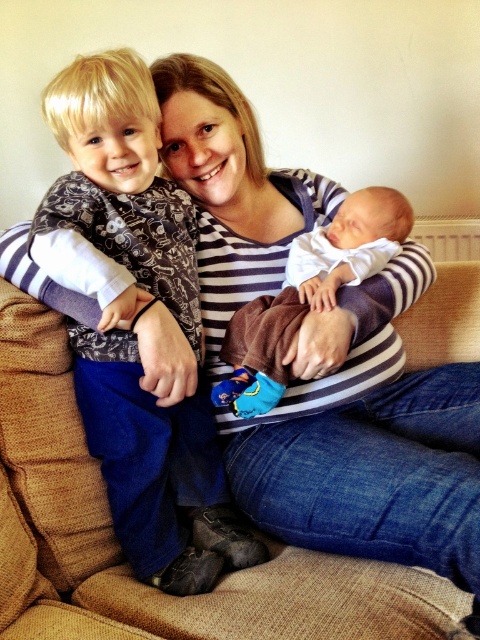
Who is shorter, striped fabric at center or brown soft blanket at center?

Standing shorter between the two is brown soft blanket at center.

The width and height of the screenshot is (480, 640). What do you see at coordinates (368, 440) in the screenshot?
I see `striped fabric at center` at bounding box center [368, 440].

Where is `striped fabric at center`? The width and height of the screenshot is (480, 640). striped fabric at center is located at coordinates (368, 440).

Is striped fabric at center to the right of matte black shirt at left from the viewer's perspective?

Indeed, striped fabric at center is positioned on the right side of matte black shirt at left.

Which is in front, point (324, 321) or point (158, 452)?

Positioned in front is point (158, 452).

Between point (448, 416) and point (120, 317), which one is positioned behind?

Point (448, 416)

In order to click on striped fabric at center in this screenshot , I will do `click(368, 440)`.

Does matte black shirt at left have a smaller size compared to brown soft blanket at center?

No, matte black shirt at left is not smaller than brown soft blanket at center.

Can you confirm if matte black shirt at left is positioned above brown soft blanket at center?

No.

Who is more distant from viewer, [107,144] or [403,228]?

The point [403,228] is behind.

At what (x,y) coordinates should I click in order to perform the action: click on matte black shirt at left. Please return your answer as a coordinate pair (x, y). Looking at the image, I should click on (131, 330).